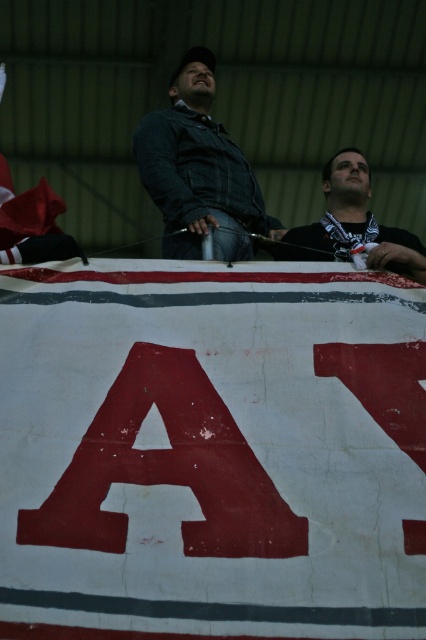
You are standing in the stadium under the worn banner. There are two points marked in the image. The first point is at coordinates point (253, 221) and the second is at point (347, 164). Which point is closer to you?

Point (253, 221) is in front of point (347, 164), so it is closer to you.